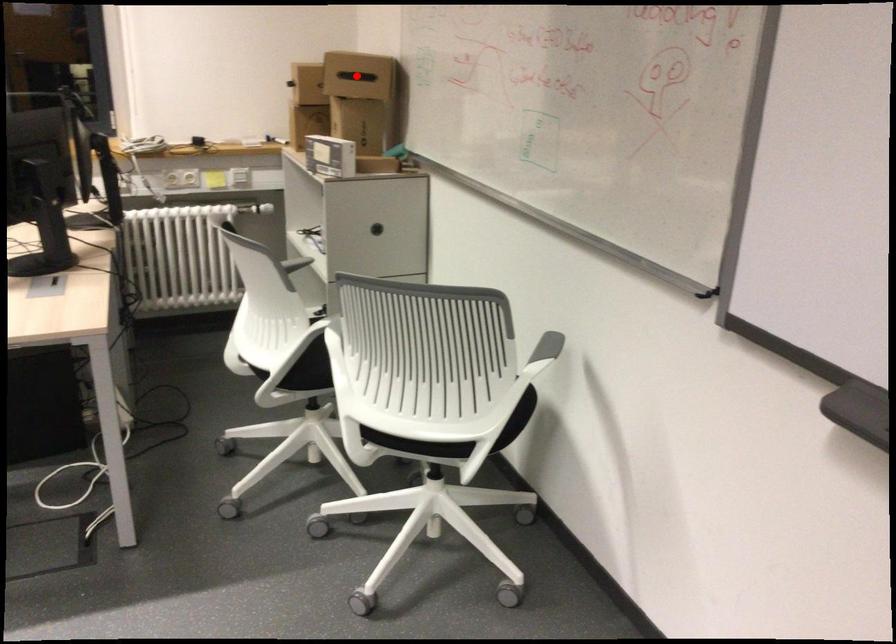
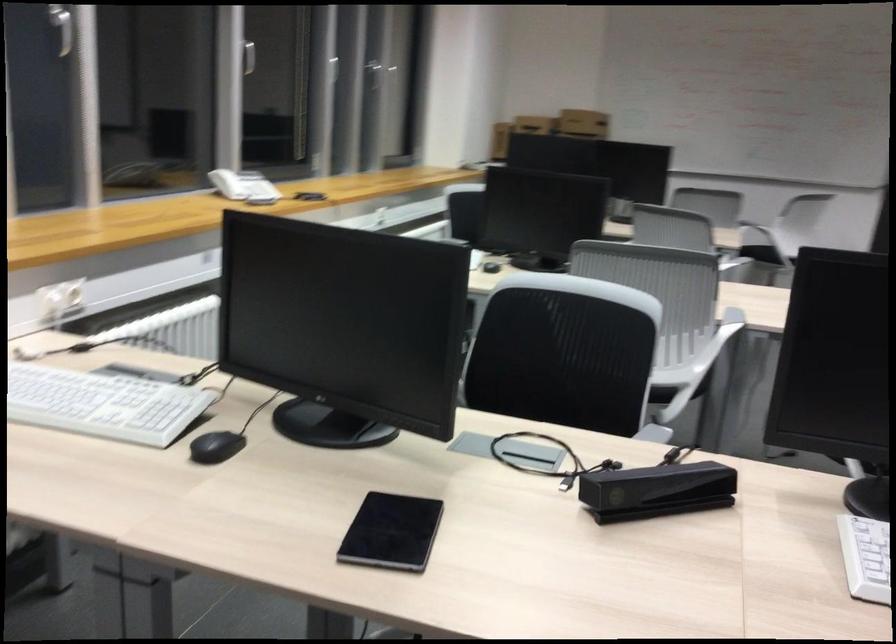
Question: I am providing you with two images of the same scene from different viewpoints. A red point is marked on the first image. Is the red point's position out of view in image 2?

Choices:
 (A) Yes
 (B) No

Answer: (A)